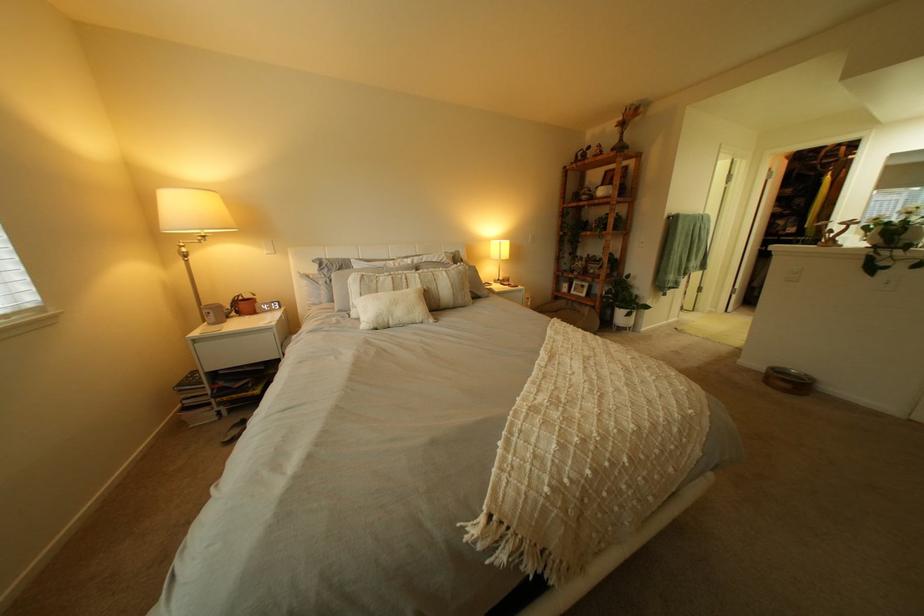
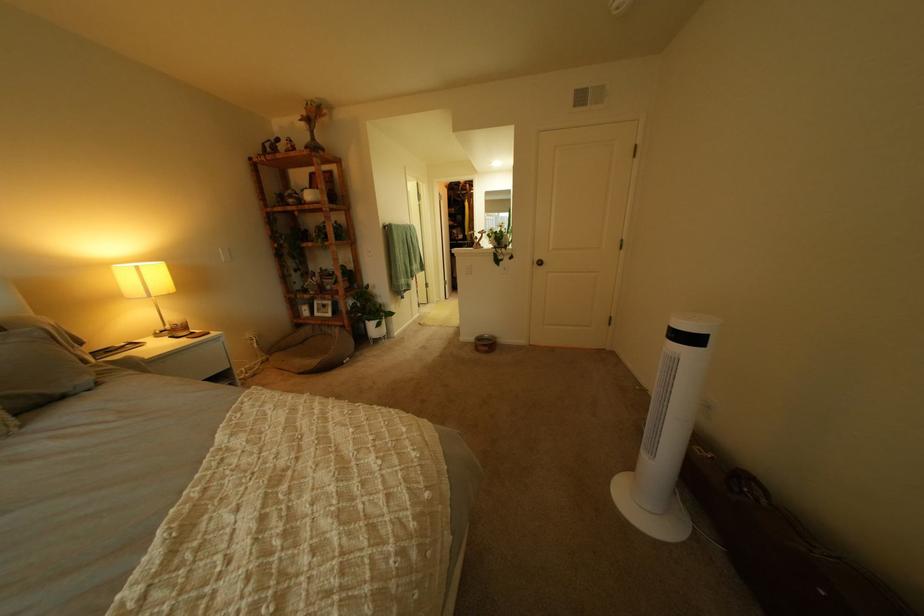
The point at [779,369] is marked in the first image. Where is the corresponding point in the second image?

(489, 339)